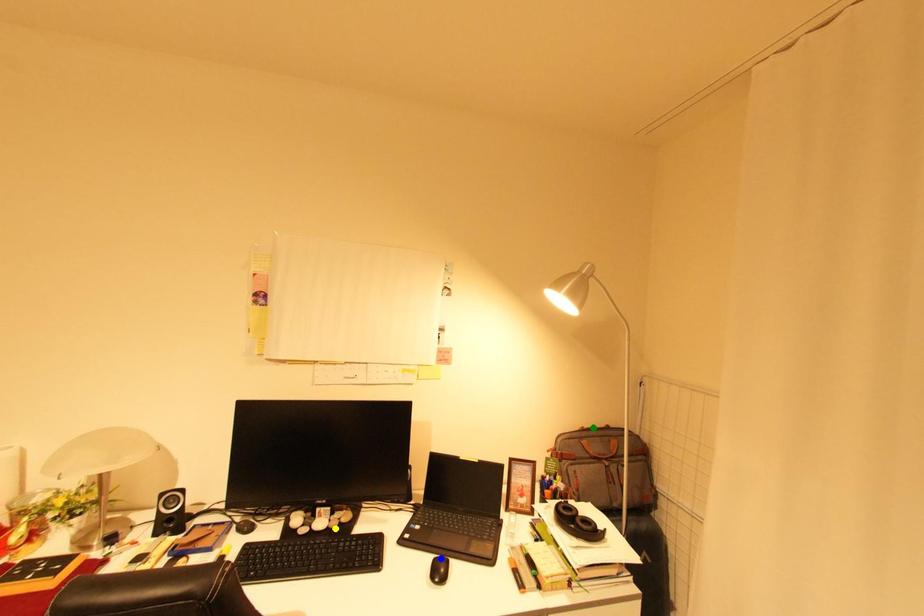
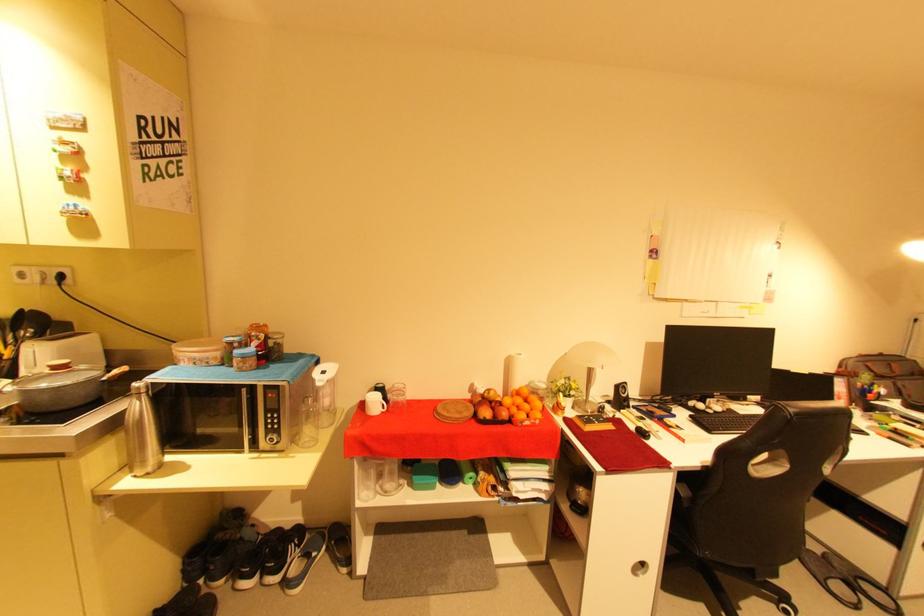
I am providing you with two images of the same scene from different viewpoints. Three points are marked in image1. Which point corresponds to a part or object that is occluded in image2?In image1, three points are marked. Which of them correspond to a part or object that is occluded in image2?Among the three points shown in image1, which one corresponds to a part or object that is no longer visible due to occlusion in image2?

blue point cannot be seen in image2.